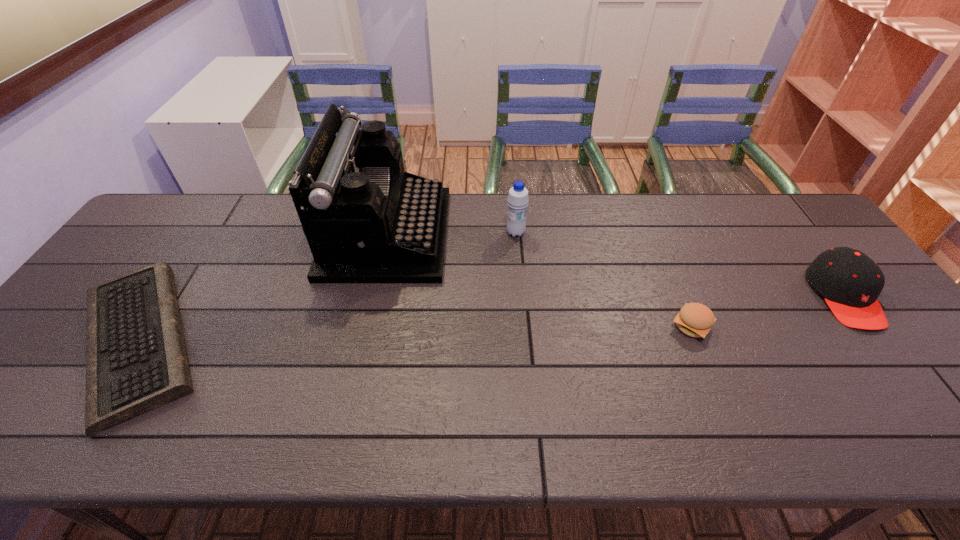
The image size is (960, 540). Identify the location of vacant region located on the front-facing side of the cap. (924, 403).

Locate an element on the screen. The height and width of the screenshot is (540, 960). vacant space located 0.120m on the right of the fourth object from left to right is located at coordinates (761, 327).

Where is `typewriter present at the far edge`? typewriter present at the far edge is located at coordinates (366, 220).

You are a GUI agent. You are given a task and a screenshot of the screen. Output one action in this format:
    pyautogui.click(x=<x>, y=<y>)
    Task: Click on the water bottle present at the far edge
    This screenshot has width=960, height=540.
    Given the screenshot: What is the action you would take?
    pyautogui.click(x=517, y=200)

What are the coordinates of `object at the right edge` in the screenshot? It's located at (850, 282).

The width and height of the screenshot is (960, 540). What are the coordinates of `vacant region at the far edge` in the screenshot? It's located at (746, 230).

The image size is (960, 540). In order to click on vacant space at the near edge of the desktop in this screenshot , I will do `click(300, 448)`.

The image size is (960, 540). In order to click on vacant area at the right edge in this screenshot , I will do `click(884, 359)`.

In the image, there is a desktop. Identify the location of vacant space at the far left corner. This screenshot has height=540, width=960. (193, 206).

Where is `free space between the tallest object and the hamburger`? The width and height of the screenshot is (960, 540). free space between the tallest object and the hamburger is located at coordinates (540, 280).